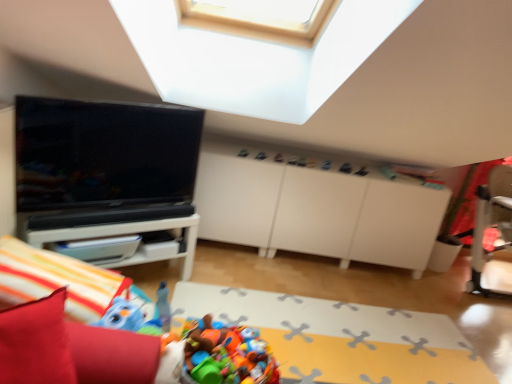
In order to click on vacant space behind matte black toy at upper center, the 3th toy when ordered from left to right in this screenshot , I will do `click(342, 160)`.